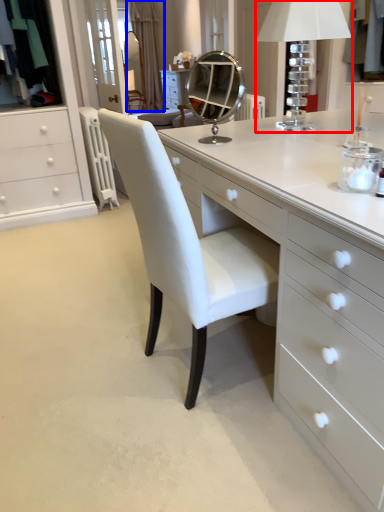
Question: Among these objects, which one is farthest to the camera, table lamp (highlighted by a red box) or curtain (highlighted by a blue box)?

Choices:
 (A) table lamp
 (B) curtain

Answer: (B)